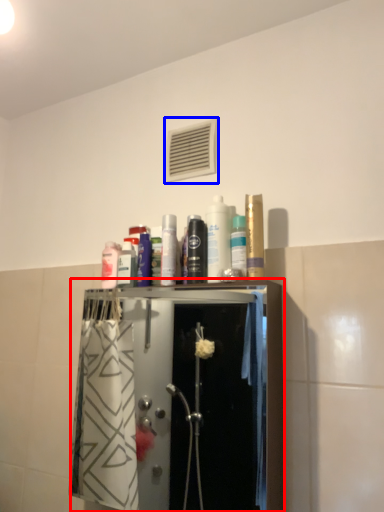
Question: Which object is further to the camera taking this photo, closet (highlighted by a red box) or air conditioning (highlighted by a blue box)?

Choices:
 (A) closet
 (B) air conditioning

Answer: (B)